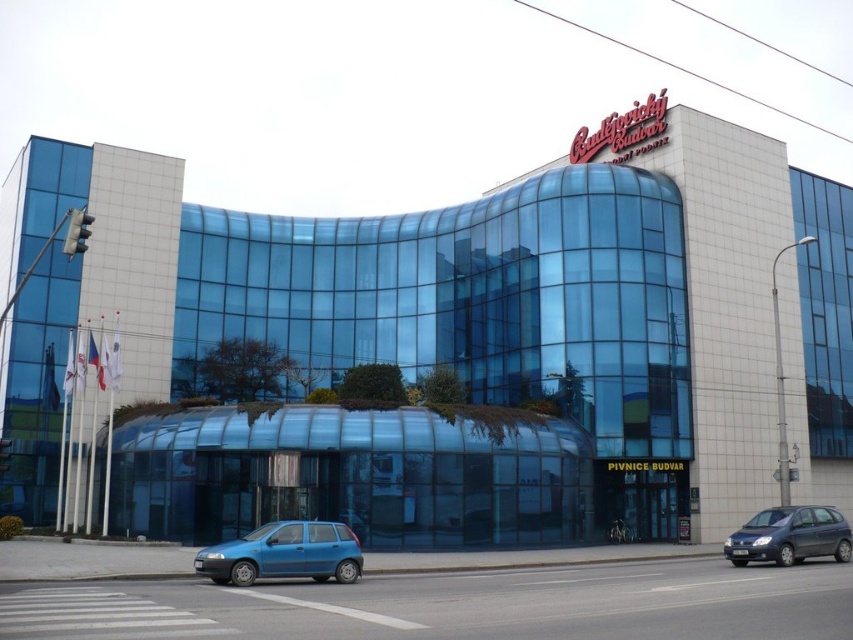
You are a delivery driver who needs to park your matte blue hatchback at center in a parking spot that is exactly the width of the transparent glass building at center. Can your car fit into the parking spot?

The transparent glass building at center might be wider than matte blue hatchback at center, so there is a possibility that the parking spot is wide enough for the matte blue hatchback at center to fit.

From the picture: You are standing in front of the modern building and want to take a photo that includes the entire structure. Considering the transparent glass building at center is 165.99 feet away from you, what is the minimum distance you should move backward to ensure the entire building fits in your camera frame?

To capture the entire transparent glass building at center in your photo, you need to be at least 165.99 feet away from it.

You are standing in front of the modern building and want to take a photo of the transparent glass building at center without any obstructions. Is the dark gray metallic hatchback at lower right blocking your view?

The transparent glass building at center is positioned over the dark gray metallic hatchback at lower right, so the hatchback is blocking part of the building in your view. To capture an unobstructed photo, you would need to move to a position where the hatchback is no longer in front of the building.